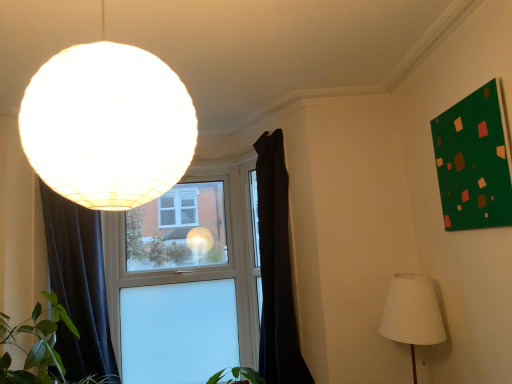
Question: Is dark fabric curtain at left, which is the first curtain in left-to-right order, bigger than white fabric lampshade at lower right, the 2th lamp in the top-to-bottom sequence?

Choices:
 (A) no
 (B) yes

Answer: (B)

Question: Considering the relative sizes of dark fabric curtain at left, which is the first curtain in left-to-right order, and white fabric lampshade at lower right, the first lamp when ordered from back to front, in the image provided, is dark fabric curtain at left, which is the first curtain in left-to-right order, smaller than white fabric lampshade at lower right, the first lamp when ordered from back to front,?

Choices:
 (A) yes
 (B) no

Answer: (B)

Question: Is the depth of dark fabric curtain at left, positioned as the second curtain in right-to-left order, greater than that of white fabric lampshade at lower right, placed as the second lamp when sorted from front to back?

Choices:
 (A) no
 (B) yes

Answer: (B)

Question: Is white fabric lampshade at lower right, the 2th lamp in the top-to-bottom sequence, surrounded by dark fabric curtain at left, positioned as the second curtain in right-to-left order?

Choices:
 (A) yes
 (B) no

Answer: (B)

Question: Is dark fabric curtain at left, positioned as the second curtain in right-to-left order, turned away from white fabric lampshade at lower right, placed as the second lamp when sorted from front to back?

Choices:
 (A) yes
 (B) no

Answer: (B)

Question: Considering the positions of matte white globe at upper left, the 1th lamp positioned from the front, and dark fabric curtain at left, which is the first curtain in left-to-right order, in the image, is matte white globe at upper left, the 1th lamp positioned from the front, bigger or smaller than dark fabric curtain at left, which is the first curtain in left-to-right order,?

Choices:
 (A) small
 (B) big

Answer: (A)

Question: From a real-world perspective, is matte white globe at upper left, the 1th lamp positioned from the front, above or below dark fabric curtain at left, positioned as the second curtain in right-to-left order?

Choices:
 (A) below
 (B) above

Answer: (B)

Question: Is matte white globe at upper left, acting as the second lamp starting from the bottom, taller or shorter than dark fabric curtain at left, which is the first curtain in left-to-right order?

Choices:
 (A) short
 (B) tall

Answer: (A)

Question: Which is correct: matte white globe at upper left, the 1th lamp positioned from the front, is inside dark fabric curtain at left, positioned as the second curtain in right-to-left order, or outside of it?

Choices:
 (A) outside
 (B) inside

Answer: (A)

Question: Would you say white fabric lampshade at lower right, placed as the second lamp when sorted from front to back, is inside or outside transparent glass window at center?

Choices:
 (A) inside
 (B) outside

Answer: (B)

Question: Is point (389, 317) positioned closer to the camera than point (119, 246)?

Choices:
 (A) farther
 (B) closer

Answer: (B)

Question: From a real-world perspective, is white fabric lampshade at lower right, marked as the first lamp in a right-to-left arrangement, physically located above or below transparent glass window at center?

Choices:
 (A) above
 (B) below

Answer: (B)

Question: Is white fabric lampshade at lower right, the first lamp when ordered from back to front, in front of or behind transparent glass window at center in the image?

Choices:
 (A) front
 (B) behind

Answer: (A)

Question: From the image's perspective, is green matte board at upper right above or below dark fabric curtain at left, positioned as the second curtain in right-to-left order?

Choices:
 (A) below
 (B) above

Answer: (B)

Question: Is green matte board at upper right situated inside dark fabric curtain at left, which is the first curtain in left-to-right order, or outside?

Choices:
 (A) outside
 (B) inside

Answer: (A)